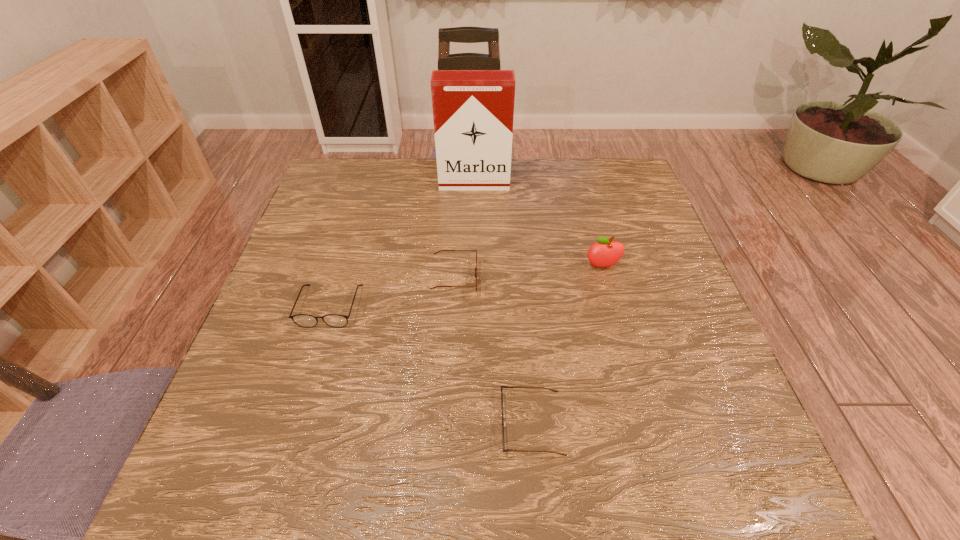
Locate an element on the screen. Image resolution: width=960 pixels, height=540 pixels. the farthest object is located at coordinates (473, 110).

Find the location of `the tallest object`. the tallest object is located at coordinates (473, 110).

What are the coordinates of `apple` in the screenshot? It's located at (605, 253).

Image resolution: width=960 pixels, height=540 pixels. In order to click on the fourth shortest object in this screenshot , I will do pos(605,253).

At what (x,y) coordinates should I click in order to perform the action: click on the leftmost spectacles. Please return your answer as a coordinate pair (x, y). The height and width of the screenshot is (540, 960). Looking at the image, I should click on (303, 320).

You are a GUI agent. You are given a task and a screenshot of the screen. Output one action in this format:
    pyautogui.click(x=<x>, y=<y>)
    Task: Click on the second spectacles from right to left
    The image size is (960, 540).
    Given the screenshot: What is the action you would take?
    pyautogui.click(x=440, y=250)

Where is `the shortest object`? the shortest object is located at coordinates (503, 423).

Where is `the rightmost spectacles`? the rightmost spectacles is located at coordinates (503, 423).

This screenshot has width=960, height=540. Find the location of `vacant space situated 0.190m on the front-facing side of the cigarette_case`. vacant space situated 0.190m on the front-facing side of the cigarette_case is located at coordinates (473, 232).

At what (x,y) coordinates should I click in order to perform the action: click on free space located 0.140m on the front of the rightmost object. Please return your answer as a coordinate pair (x, y). Looking at the image, I should click on (615, 316).